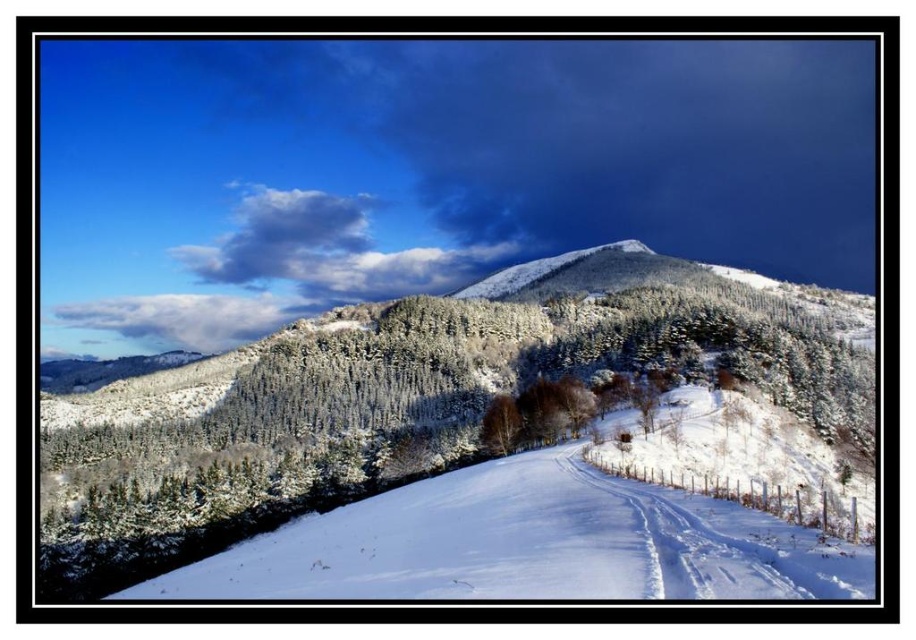
Question: Is white snow ski slope at center positioned before brown wood tree at center?

Choices:
 (A) no
 (B) yes

Answer: (B)

Question: Does white snow ski slope at center appear under brown wood tree at center?

Choices:
 (A) no
 (B) yes

Answer: (A)

Question: Which object appears farthest from the camera in this image?

Choices:
 (A) white snow ski slope at center
 (B) brown wood tree at center

Answer: (B)

Question: Among these objects, which one is farthest from the camera?

Choices:
 (A) white snow ski slope at center
 (B) brown wood tree at center

Answer: (B)

Question: Can you confirm if white snow ski slope at center is wider than brown wood tree at center?

Choices:
 (A) no
 (B) yes

Answer: (B)